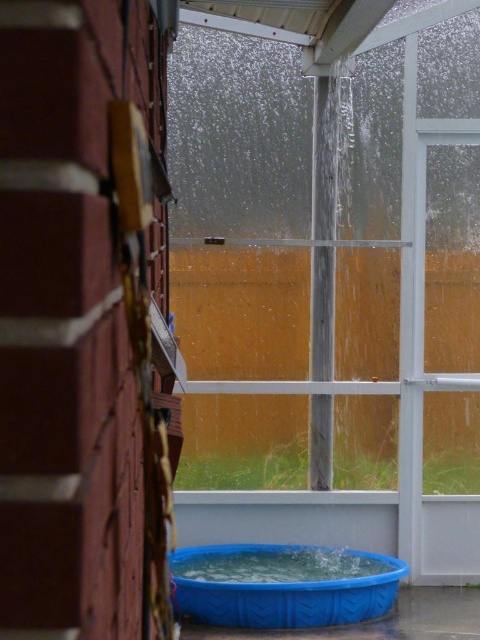
Question: Can you confirm if transparent plastic window at center is positioned below blue plastic pool at lower center?

Choices:
 (A) yes
 (B) no

Answer: (B)

Question: Which object is farther from the camera taking this photo?

Choices:
 (A) blue plastic pool at lower center
 (B) transparent plastic window at center

Answer: (B)

Question: Is transparent plastic window at center closer to camera compared to blue plastic pool at lower center?

Choices:
 (A) no
 (B) yes

Answer: (A)

Question: Can you confirm if transparent plastic window at center is bigger than blue plastic pool at lower center?

Choices:
 (A) no
 (B) yes

Answer: (B)